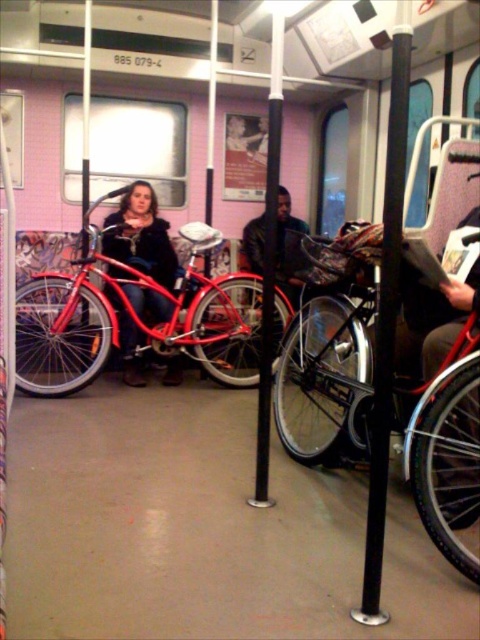
Does shiny metallic bicycle at center appear on the right side of black matte pole at center?

Correct, you'll find shiny metallic bicycle at center to the right of black matte pole at center.

Can you confirm if shiny metallic bicycle at center is wider than black matte pole at center?

Yes, shiny metallic bicycle at center is wider than black matte pole at center.

This screenshot has height=640, width=480. Describe the element at coordinates (326, 356) in the screenshot. I see `shiny metallic bicycle at center` at that location.

Where is `shiny metallic bicycle at center`? shiny metallic bicycle at center is located at coordinates (326, 356).

Does point (361, 612) lie in front of point (131, 192)?

Yes, point (361, 612) is closer to viewer.

Can you confirm if black metal pole at center is positioned to the left of matte black jacket at center?

In fact, black metal pole at center is to the right of matte black jacket at center.

In order to click on black metal pole at center in this screenshot , I will do `click(385, 328)`.

You are a GUI agent. You are given a task and a screenshot of the screen. Output one action in this format:
    pyautogui.click(x=<x>, y=<y>)
    Task: Click on the black metal pole at center
    
    Given the screenshot: What is the action you would take?
    pyautogui.click(x=385, y=328)

Is shiny metallic bicycle at center bigger than matte black jacket at center?

Indeed, shiny metallic bicycle at center has a larger size compared to matte black jacket at center.

Between point (331, 252) and point (137, 378), which one is positioned behind?

The point (137, 378) is more distant.

The width and height of the screenshot is (480, 640). What are the coordinates of `shiny metallic bicycle at center` in the screenshot? It's located at (326, 356).

This screenshot has width=480, height=640. What are the coordinates of `shiny metallic bicycle at center` in the screenshot? It's located at (326, 356).